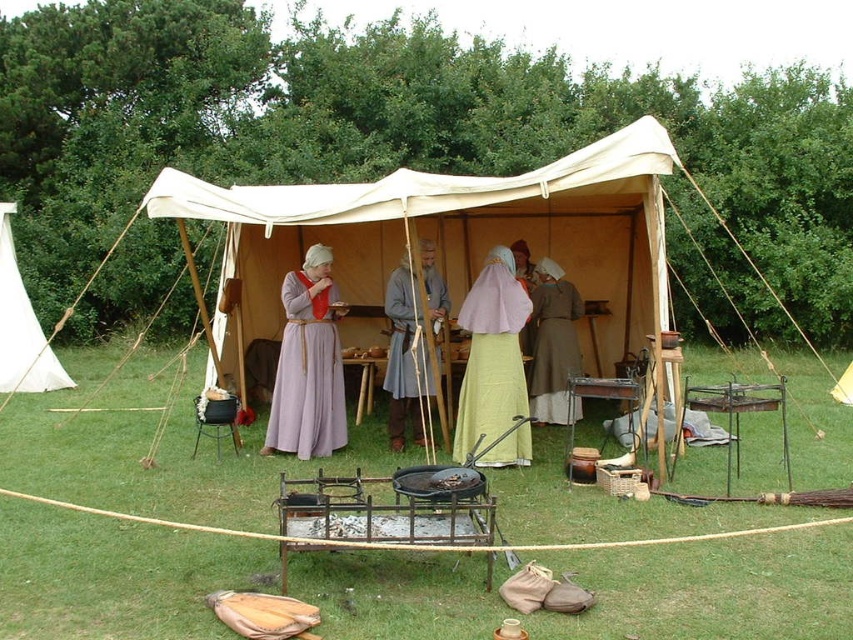
You are a visitor at this historical reenactment and want to take a photo of both the gray woolen tunic at center and the brown woolen robe at center. Which one should you focus on first to ensure both are in the frame?

You should focus on the gray woolen tunic at center first because it is closer to you than the brown woolen robe at center, so adjusting the focus from near to far will help capture both in the frame.